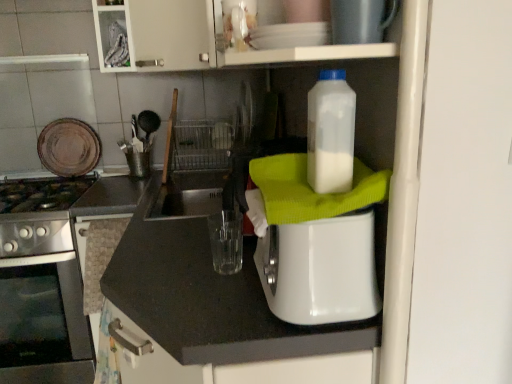
Question: Does brown matte plate at upper left, arranged as the first appliance when viewed from the left, lie in front of translucent plastic bottle at upper right?

Choices:
 (A) no
 (B) yes

Answer: (A)

Question: Does brown matte plate at upper left, arranged as the first appliance when viewed from the left, have a lesser height compared to translucent plastic bottle at upper right?

Choices:
 (A) no
 (B) yes

Answer: (A)

Question: Would you consider brown matte plate at upper left, which is the third appliance in front-to-back order, to be distant from translucent plastic bottle at upper right?

Choices:
 (A) no
 (B) yes

Answer: (B)

Question: Considering the relative positions of brown matte plate at upper left, the first appliance from the back, and translucent plastic bottle at upper right in the image provided, is brown matte plate at upper left, the first appliance from the back, behind translucent plastic bottle at upper right?

Choices:
 (A) yes
 (B) no

Answer: (A)

Question: Is brown matte plate at upper left, arranged as the first appliance when viewed from the left, aimed at translucent plastic bottle at upper right?

Choices:
 (A) no
 (B) yes

Answer: (A)

Question: Considering the relative sizes of brown matte plate at upper left, which is counted as the third appliance, starting from the right, and translucent plastic bottle at upper right in the image provided, is brown matte plate at upper left, which is counted as the third appliance, starting from the right, bigger than translucent plastic bottle at upper right?

Choices:
 (A) yes
 (B) no

Answer: (A)

Question: Can you confirm if metallic silver toaster at upper center, the first appliance positioned from the front, is bigger than white plastic toaster at center, which ranks as the 2th appliance in back-to-front order?

Choices:
 (A) no
 (B) yes

Answer: (A)

Question: Could you tell me if metallic silver toaster at upper center, the third appliance when ordered from left to right, is facing white plastic toaster at center, marked as the 2th appliance in a front-to-back arrangement?

Choices:
 (A) yes
 (B) no

Answer: (B)

Question: Considering the relative sizes of metallic silver toaster at upper center, the third appliance when ordered from left to right, and white plastic toaster at center, the second appliance from the left, in the image provided, is metallic silver toaster at upper center, the third appliance when ordered from left to right, smaller than white plastic toaster at center, the second appliance from the left,?

Choices:
 (A) yes
 (B) no

Answer: (A)

Question: From the image's perspective, is metallic silver toaster at upper center, the third appliance when ordered from left to right, on top of white plastic toaster at center, the second appliance from the left?

Choices:
 (A) yes
 (B) no

Answer: (A)

Question: Is metallic silver toaster at upper center, the first appliance positioned from the front, looking in the opposite direction of white plastic toaster at center, which ranks as the second appliance in right-to-left order?

Choices:
 (A) yes
 (B) no

Answer: (B)

Question: Is metallic silver toaster at upper center, the third appliance when ordered from left to right, not near white plastic toaster at center, marked as the 2th appliance in a front-to-back arrangement?

Choices:
 (A) yes
 (B) no

Answer: (B)

Question: Could you tell me if brown matte plate at upper left, which is the third appliance in front-to-back order, is turned towards white plastic toaster at center, marked as the 2th appliance in a front-to-back arrangement?

Choices:
 (A) yes
 (B) no

Answer: (B)